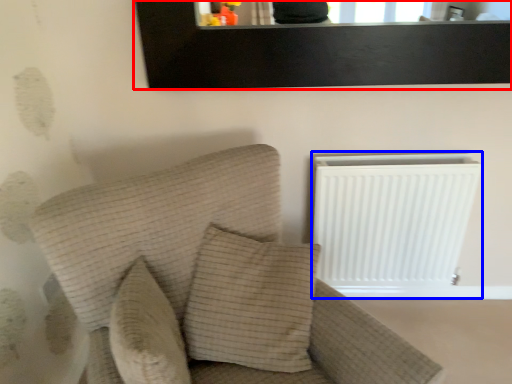
Question: Among these objects, which one is nearest to the camera, picture frame (highlighted by a red box) or radiator (highlighted by a blue box)?

Choices:
 (A) picture frame
 (B) radiator

Answer: (A)